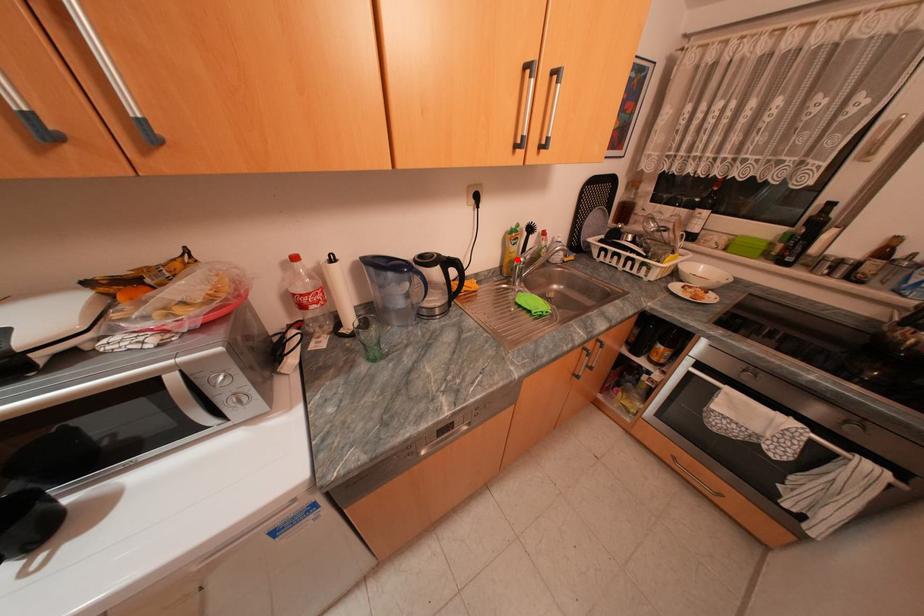
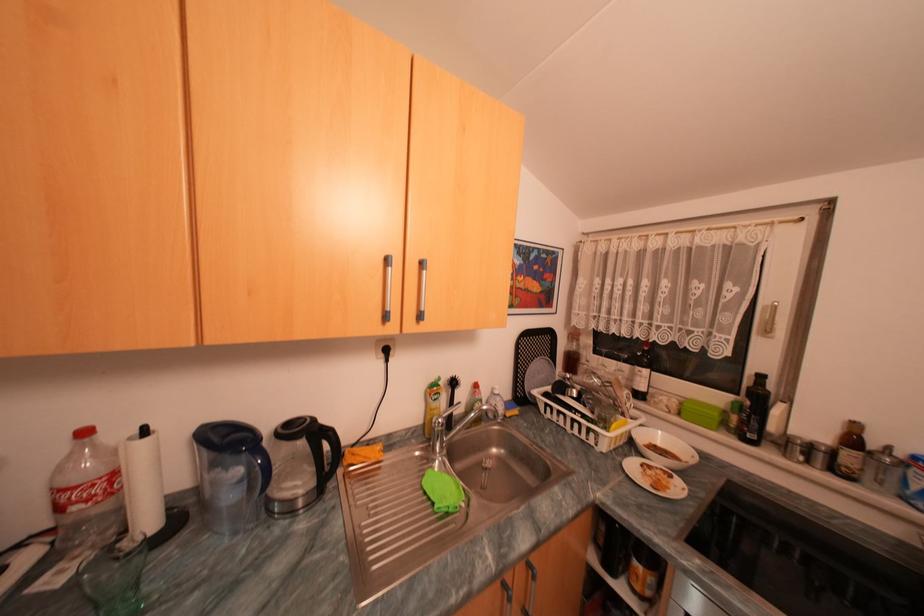
Question: I am providing you with two images of the same scene from different viewpoints. Given a red point in image1, look at the same physical point in image2. Is it:

Choices:
 (A) Closer to the viewpoint
 (B) Farther from the viewpoint

Answer: (B)